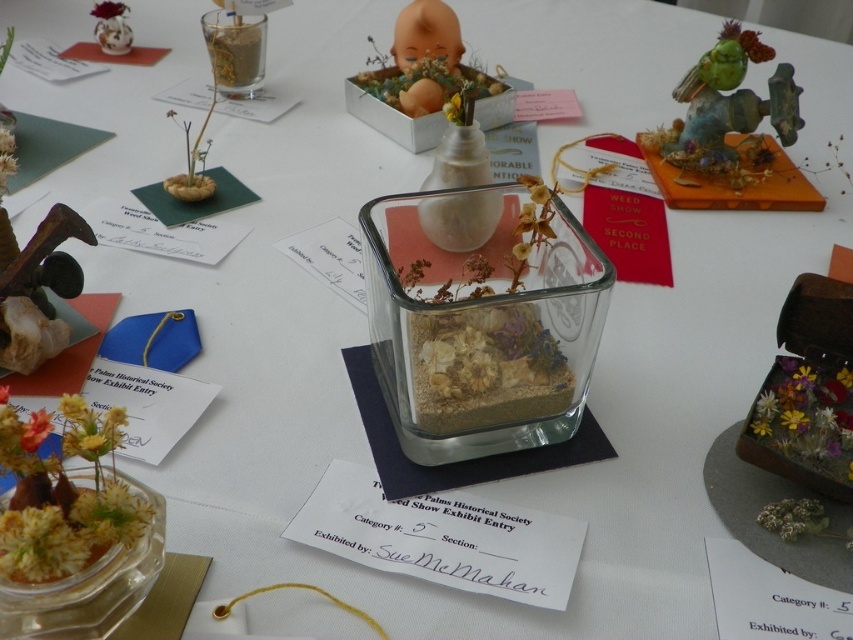
Question: Can you confirm if green matte bird at upper right is wider than matte white figurine at upper left?

Choices:
 (A) yes
 (B) no

Answer: (A)

Question: Which point is farther to the camera?

Choices:
 (A) (732, 26)
 (B) (418, 13)

Answer: (B)

Question: Where is matte orange baby at center located in relation to matte white figurine at upper left in the image?

Choices:
 (A) above
 (B) below

Answer: (B)

Question: Does matte orange baby at center appear under matte white figurine at upper left?

Choices:
 (A) yes
 (B) no

Answer: (A)

Question: Among these points, which one is farthest from the camera?

Choices:
 (A) (738, 179)
 (B) (440, 99)

Answer: (B)

Question: Which object is closer to the camera taking this photo?

Choices:
 (A) green matte bird at upper right
 (B) matte orange baby at center
 (C) matte white figurine at upper left

Answer: (B)